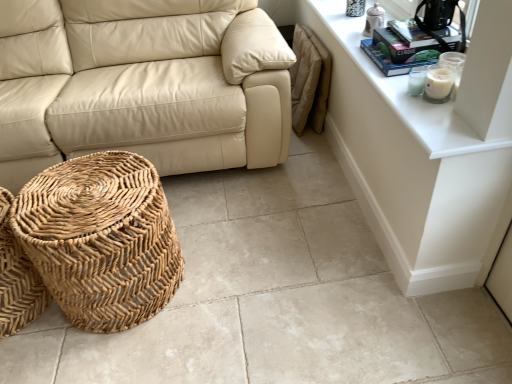
Question: Is woven natural basket at lower left, acting as the 1th basket starting from the left, smaller than white glossy dresser at upper right?

Choices:
 (A) yes
 (B) no

Answer: (B)

Question: Is woven natural basket at lower left, acting as the second basket starting from the right, outside of white glossy dresser at upper right?

Choices:
 (A) no
 (B) yes

Answer: (B)

Question: From the image's perspective, is woven natural basket at lower left, acting as the second basket starting from the right, on white glossy dresser at upper right?

Choices:
 (A) no
 (B) yes

Answer: (A)

Question: Considering the relative positions of woven natural basket at lower left, acting as the 1th basket starting from the left, and white glossy dresser at upper right in the image provided, is woven natural basket at lower left, acting as the 1th basket starting from the left, to the left of white glossy dresser at upper right from the viewer's perspective?

Choices:
 (A) no
 (B) yes

Answer: (B)

Question: Does woven natural basket at lower left, acting as the second basket starting from the right, have a lesser height compared to white glossy dresser at upper right?

Choices:
 (A) no
 (B) yes

Answer: (B)

Question: From the image's perspective, is woven natural basket at lower left, acting as the 1th basket starting from the left, located above or below natural woven basket at lower left, the 1th basket positioned from the right?

Choices:
 (A) below
 (B) above

Answer: (A)

Question: Is woven natural basket at lower left, acting as the 1th basket starting from the left, inside the boundaries of natural woven basket at lower left, which is the 2th basket from left to right, or outside?

Choices:
 (A) outside
 (B) inside

Answer: (A)

Question: From their relative heights in the image, would you say woven natural basket at lower left, acting as the second basket starting from the right, is taller or shorter than natural woven basket at lower left, the 1th basket positioned from the right?

Choices:
 (A) tall
 (B) short

Answer: (B)

Question: In terms of width, does woven natural basket at lower left, acting as the second basket starting from the right, look wider or thinner when compared to natural woven basket at lower left, which is the 2th basket from left to right?

Choices:
 (A) thin
 (B) wide

Answer: (A)

Question: From the image's perspective, is natural woven basket at lower left, which is the 2th basket from left to right, positioned above or below beige leather couch at center?

Choices:
 (A) above
 (B) below

Answer: (B)

Question: Looking at their shapes, would you say natural woven basket at lower left, the 1th basket positioned from the right, is wider or thinner than beige leather couch at center?

Choices:
 (A) thin
 (B) wide

Answer: (A)

Question: Considering the relative positions of natural woven basket at lower left, the 1th basket positioned from the right, and beige leather couch at center in the image provided, is natural woven basket at lower left, the 1th basket positioned from the right, to the left or to the right of beige leather couch at center?

Choices:
 (A) left
 (B) right

Answer: (B)

Question: From a real-world perspective, is natural woven basket at lower left, the 1th basket positioned from the right, physically located above or below beige leather couch at center?

Choices:
 (A) above
 (B) below

Answer: (B)

Question: Considering their positions, is white glass candle at upper right located in front of or behind beige leather couch at center?

Choices:
 (A) front
 (B) behind

Answer: (A)

Question: Would you say white glass candle at upper right is to the left or to the right of beige leather couch at center in the picture?

Choices:
 (A) right
 (B) left

Answer: (A)